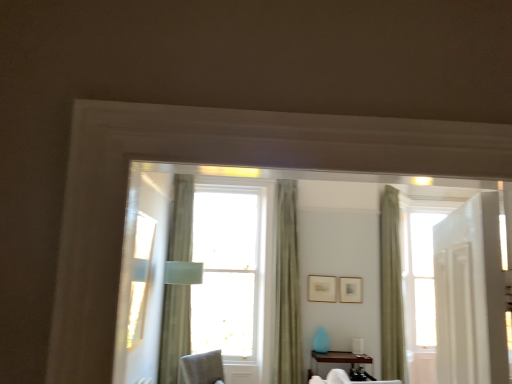
Question: Is light beige fabric curtain at center, placed as the 3th curtain when sorted from right to left, to the left of transparent glass window at center from the viewer's perspective?

Choices:
 (A) yes
 (B) no

Answer: (A)

Question: Considering the relative positions of light beige fabric curtain at center, the 1th curtain viewed from the left, and transparent glass window at center in the image provided, is light beige fabric curtain at center, the 1th curtain viewed from the left, to the right of transparent glass window at center from the viewer's perspective?

Choices:
 (A) no
 (B) yes

Answer: (A)

Question: Does light beige fabric curtain at center, the 1th curtain viewed from the left, have a greater width compared to transparent glass window at center?

Choices:
 (A) yes
 (B) no

Answer: (B)

Question: From a real-world perspective, is light beige fabric curtain at center, the 1th curtain viewed from the left, positioned under transparent glass window at center based on gravity?

Choices:
 (A) no
 (B) yes

Answer: (B)

Question: Can you confirm if light beige fabric curtain at center, the 1th curtain viewed from the left, is bigger than transparent glass window at center?

Choices:
 (A) no
 (B) yes

Answer: (A)

Question: Considering the relative positions of green fabric curtain at right, which appears as the first curtain when viewed from the right, and wooden picture frame at center, the first picture frame from the left, in the image provided, is green fabric curtain at right, which appears as the first curtain when viewed from the right, to the left or to the right of wooden picture frame at center, the first picture frame from the left,?

Choices:
 (A) right
 (B) left

Answer: (A)

Question: Considering the positions of point coord(396,215) and point coord(334,301), is point coord(396,215) closer or farther from the camera than point coord(334,301)?

Choices:
 (A) closer
 (B) farther

Answer: (A)

Question: Is green fabric curtain at right, the 3th curtain from the left, bigger or smaller than wooden picture frame at center, which appears as the second picture frame when viewed from the right?

Choices:
 (A) big
 (B) small

Answer: (A)

Question: In the image, is green fabric curtain at right, the 3th curtain from the left, positioned in front of or behind wooden picture frame at center, which appears as the second picture frame when viewed from the right?

Choices:
 (A) front
 (B) behind

Answer: (A)

Question: Considering the positions of light beige fabric curtain at center, placed as the 3th curtain when sorted from right to left, and transparent glass window at center in the image, is light beige fabric curtain at center, placed as the 3th curtain when sorted from right to left, wider or thinner than transparent glass window at center?

Choices:
 (A) wide
 (B) thin

Answer: (B)

Question: Considering the relative positions of light beige fabric curtain at center, placed as the 3th curtain when sorted from right to left, and transparent glass window at center in the image provided, is light beige fabric curtain at center, placed as the 3th curtain when sorted from right to left, to the left or to the right of transparent glass window at center?

Choices:
 (A) right
 (B) left

Answer: (B)

Question: Is point (168, 345) closer or farther from the camera than point (287, 337)?

Choices:
 (A) closer
 (B) farther

Answer: (A)

Question: From a real-world perspective, is light beige fabric curtain at center, the 1th curtain viewed from the left, above or below transparent glass window at center?

Choices:
 (A) below
 (B) above

Answer: (A)

Question: Which is correct: matte silver picture frame at center, which is the 1th picture frame from right to left, is inside wooden picture frame at center, which appears as the second picture frame when viewed from the right, or outside of it?

Choices:
 (A) inside
 (B) outside

Answer: (B)

Question: In terms of height, does matte silver picture frame at center, which appears as the 2th picture frame when viewed from the left, look taller or shorter compared to wooden picture frame at center, which appears as the second picture frame when viewed from the right?

Choices:
 (A) tall
 (B) short

Answer: (B)